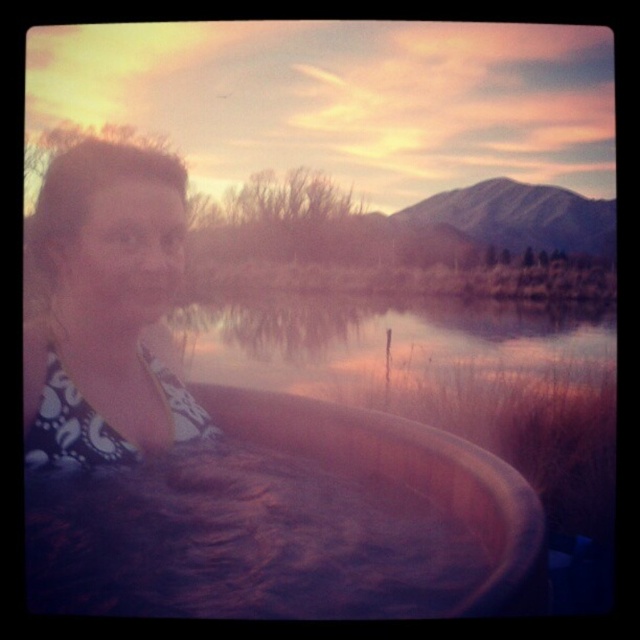
Question: Which point is farther to the camera?

Choices:
 (A) transparent water at center
 (B) matte black bikini top at left
 (C) brown wooden tub at lower center

Answer: (A)

Question: Among these objects, which one is nearest to the camera?

Choices:
 (A) brown wooden tub at lower center
 (B) transparent water at center

Answer: (A)

Question: Does matte black bikini top at left have a greater width compared to transparent water at center?

Choices:
 (A) yes
 (B) no

Answer: (B)

Question: Is matte black bikini top at left bigger than transparent water at center?

Choices:
 (A) yes
 (B) no

Answer: (B)

Question: Estimate the real-world distances between objects in this image. Which object is closer to the matte black bikini top at left?

Choices:
 (A) brown wooden tub at lower center
 (B) transparent water at center

Answer: (A)

Question: Is brown wooden tub at lower center bigger than transparent water at center?

Choices:
 (A) yes
 (B) no

Answer: (B)